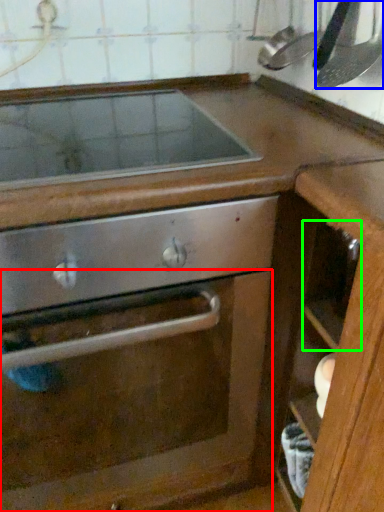
Question: Which object is the farthest from glass door (highlighted by a red box)? Choose among these: kitchen appliance (highlighted by a blue box) or drawer (highlighted by a green box).

Choices:
 (A) kitchen appliance
 (B) drawer

Answer: (A)